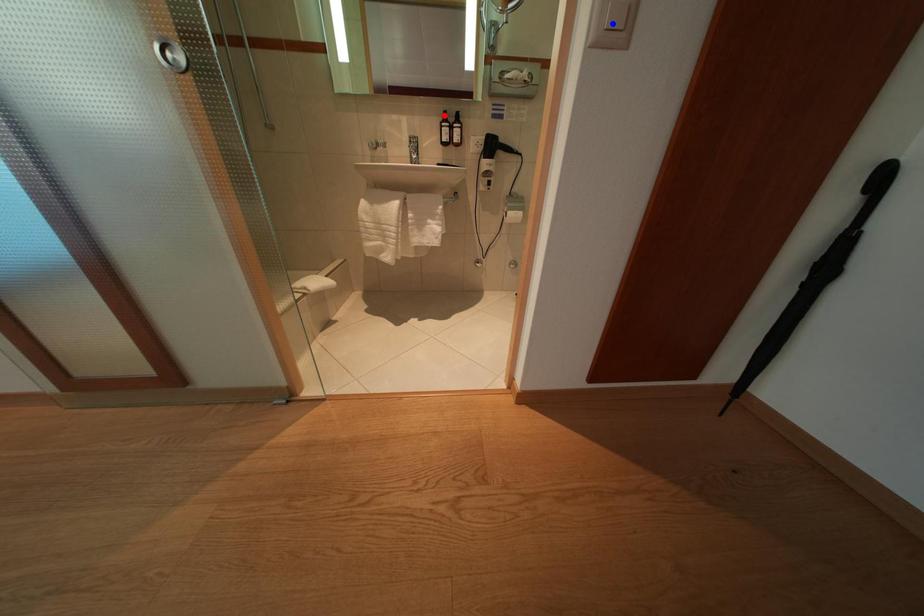
Question: Two points are marked on the image. Which point is closer to the camera?

Choices:
 (A) Blue point is closer.
 (B) Red point is closer.

Answer: (A)